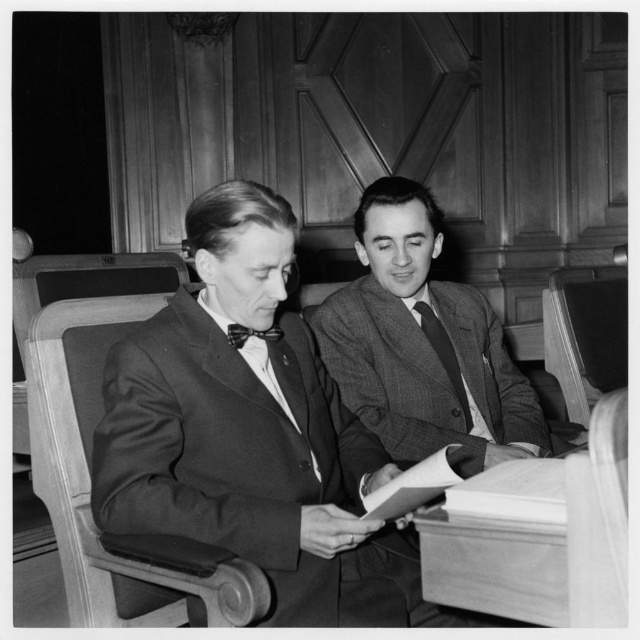
Question: Which object is positioned farthest from the smooth black suit at left?

Choices:
 (A) wooden chair at left
 (B) plaid fabric bow tie at center

Answer: (A)

Question: Does wooden chair at right appear over black textured tie at center?

Choices:
 (A) yes
 (B) no

Answer: (A)

Question: In this image, where is smooth black suit at left located relative to wooden chair at left?

Choices:
 (A) left
 (B) right

Answer: (B)

Question: Can you confirm if textured gray suit at center is positioned to the right of black textured tie at center?

Choices:
 (A) no
 (B) yes

Answer: (A)

Question: Which object appears closest to the camera in this image?

Choices:
 (A) smooth black suit at left
 (B) wooden chair at left

Answer: (B)

Question: Which object appears closest to the camera in this image?

Choices:
 (A) textured gray suit at center
 (B) smooth black suit at left

Answer: (B)